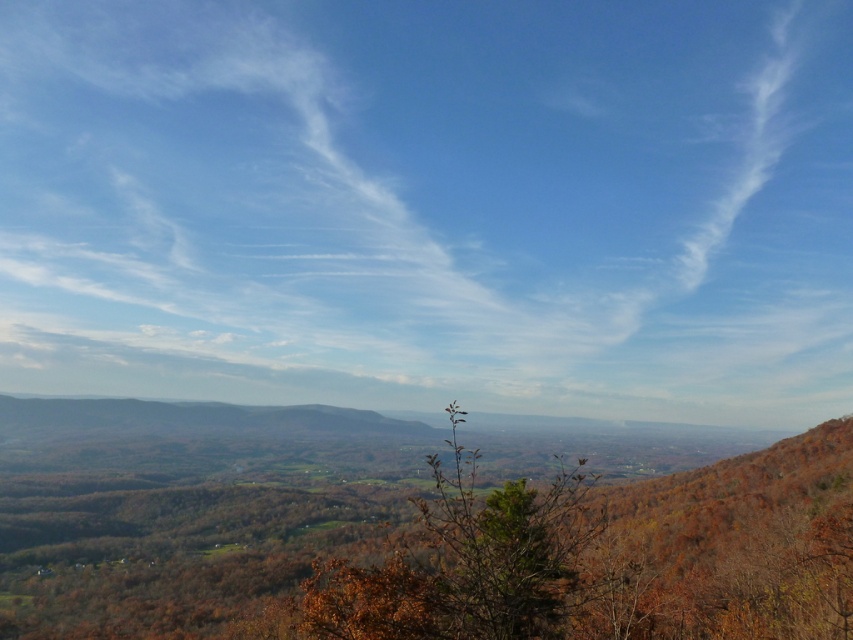
You are an astronomer analyzing the image. You need to determine the exact location of the white cotton cloud at upper center. What are its coordinates?

The white cotton cloud at upper center is located at coordinates point (431, 205).

You are standing in the hilly landscape and looking at the point with coordinates (431, 205). What is this point located on?

The point (431, 205) is located on the white cotton cloud at upper center.

You are an artist sketching the landscape and want to ensure the white cotton cloud at upper center and brown leafy tree at center are positioned correctly relative to each other. According to the scene, which object is located to the right side?

The white cotton cloud at upper center is to the right of brown leafy tree at center.